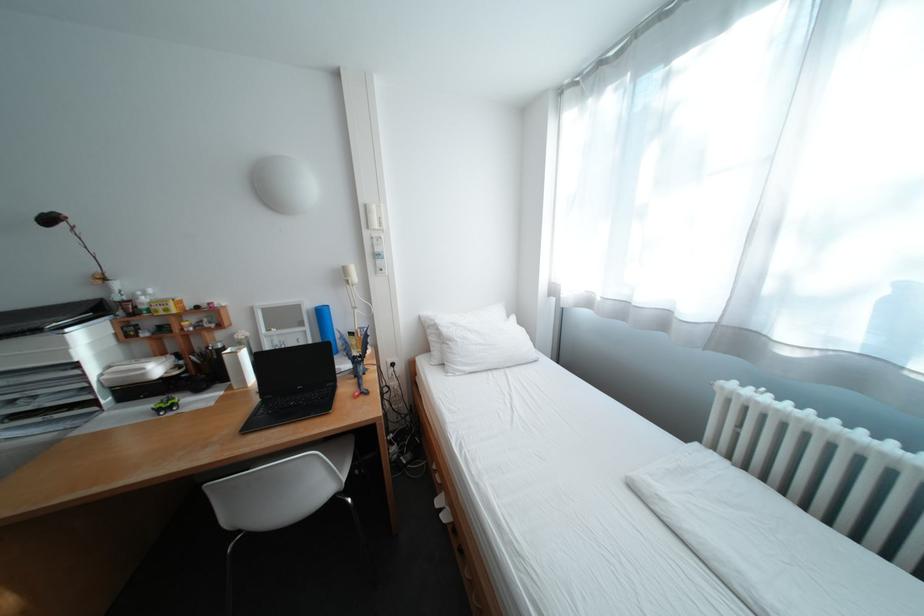
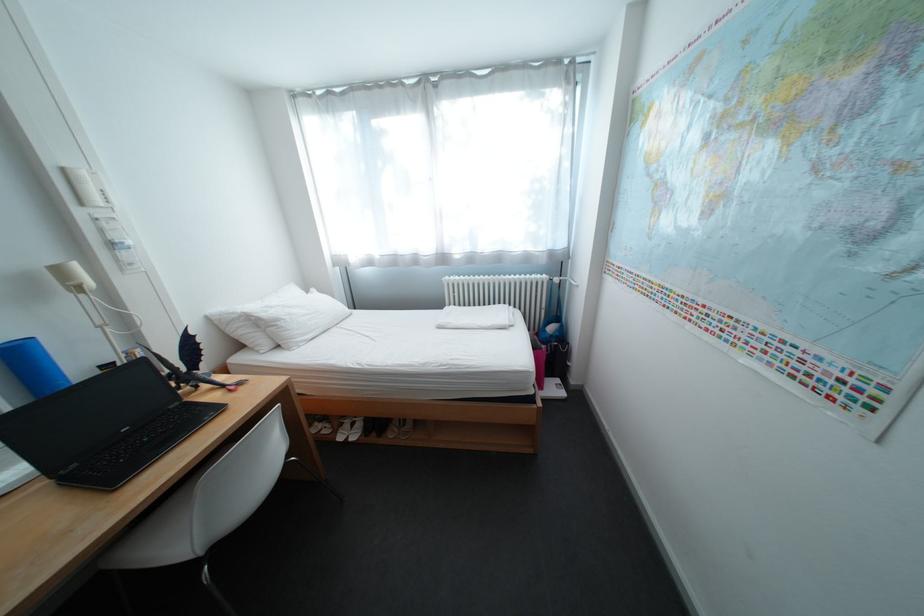
Where in the second image is the point corresponding to point 379,207 from the first image?

(76, 171)